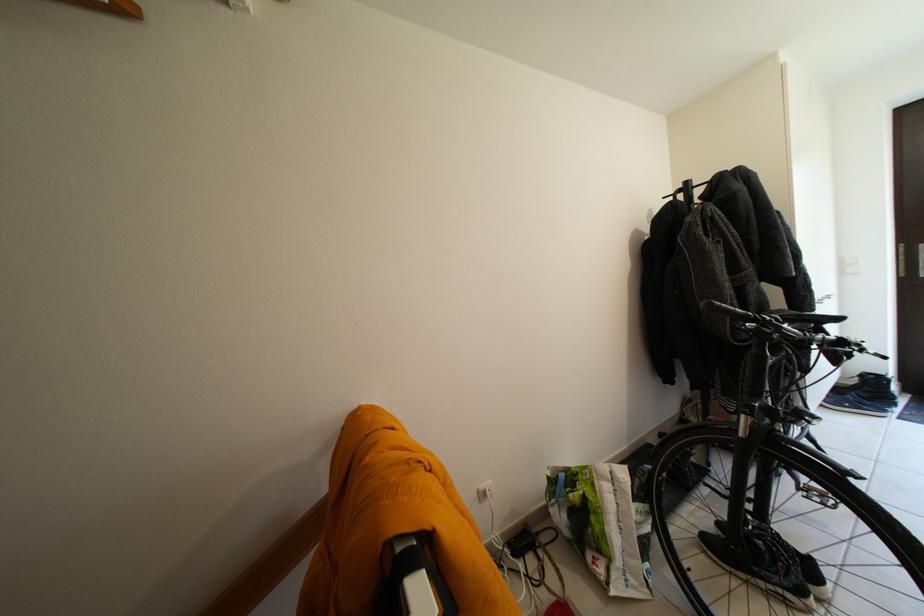
The width and height of the screenshot is (924, 616). Describe the element at coordinates (483, 492) in the screenshot. I see `the white electrical plug` at that location.